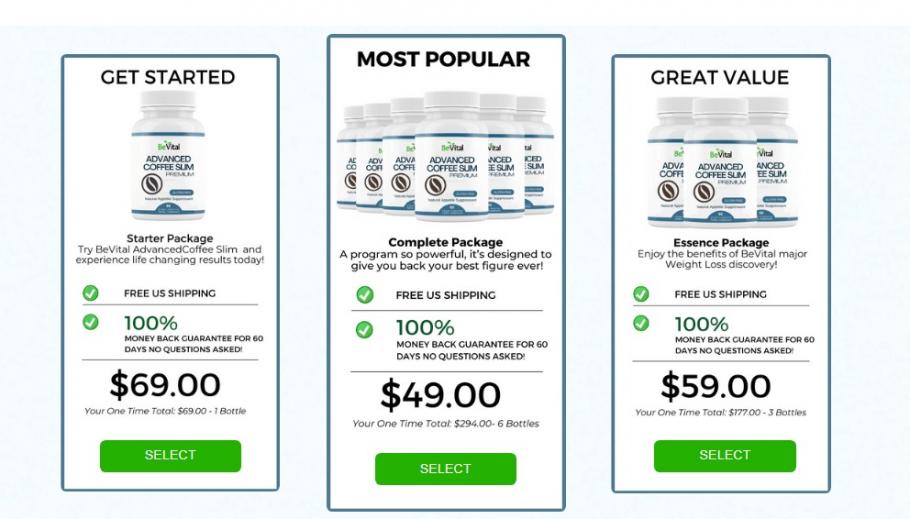
You are a GUI agent. You are given a task and a screenshot of the screen. Output one action in this format:
    pyautogui.click(x=<x>, y=<y>)
    Task: Click on the product bottles
    This screenshot has width=910, height=519.
    Given the screenshot: What is the action you would take?
    pyautogui.click(x=186, y=163), pyautogui.click(x=349, y=163), pyautogui.click(x=372, y=160), pyautogui.click(x=403, y=158), pyautogui.click(x=455, y=159), pyautogui.click(x=498, y=165), pyautogui.click(x=541, y=161), pyautogui.click(x=676, y=175), pyautogui.click(x=735, y=163), pyautogui.click(x=775, y=175)